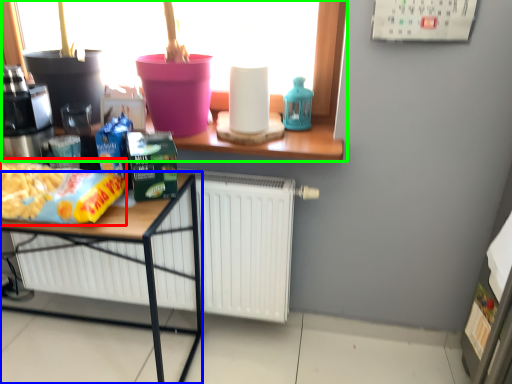
Question: Which is nearer to the food (highlighted by a red box)? desk (highlighted by a blue box) or window (highlighted by a green box).

Choices:
 (A) desk
 (B) window

Answer: (A)